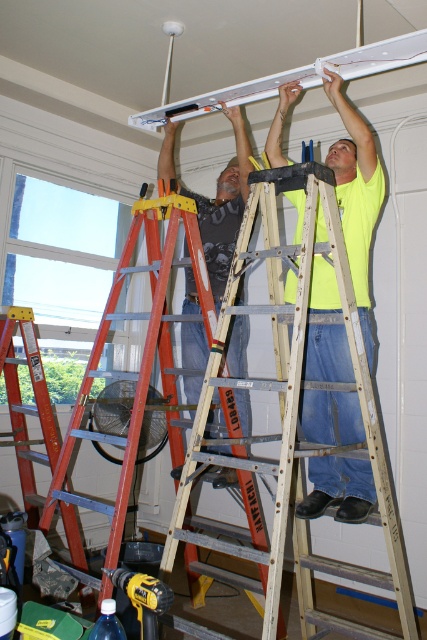
Question: Is matte black shirt at upper center wider than yellow plastic drill at lower left?

Choices:
 (A) yes
 (B) no

Answer: (A)

Question: Based on their relative distances, which object is farther from the wooden ladder at center?

Choices:
 (A) matte black shirt at upper center
 (B) white plastic beam at upper center
 (C) yellow plastic drill at lower left

Answer: (B)

Question: Does yellow reflective safety vest at upper center appear under matte black shirt at upper center?

Choices:
 (A) yes
 (B) no

Answer: (A)

Question: Can you confirm if matte black shirt at upper center is smaller than white plastic beam at upper center?

Choices:
 (A) yes
 (B) no

Answer: (B)

Question: Considering the real-world distances, which object is closest to the matte black shirt at upper center?

Choices:
 (A) yellow plastic drill at lower left
 (B) wooden ladder at center

Answer: (B)

Question: Which of the following is the closest to the observer?

Choices:
 (A) yellow reflective safety vest at upper center
 (B) white plastic beam at upper center
 (C) matte black shirt at upper center

Answer: (B)